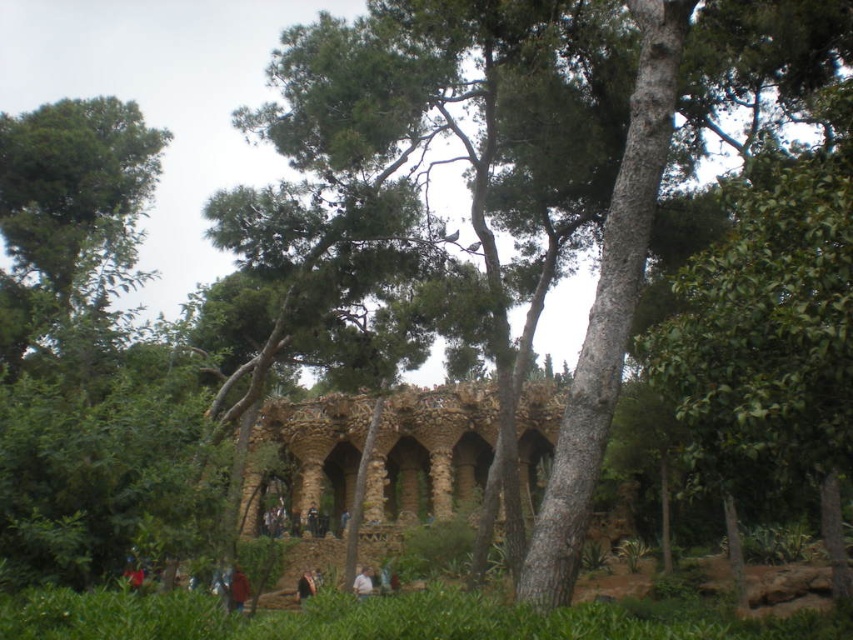
Question: Which object appears closest to the camera in this image?

Choices:
 (A) brown leather jacket at lower center
 (B) red fabric person at lower center
 (C) brown stone ruins at center

Answer: (B)

Question: Which point is closer to the camera?

Choices:
 (A) (309, 516)
 (B) (242, 580)
 (C) (416, 449)
 (D) (368, 595)

Answer: (D)

Question: Is brown stone ruins at center to the left of light brown leather jacket at lower center from the viewer's perspective?

Choices:
 (A) yes
 (B) no

Answer: (B)

Question: Which object is positioned farthest from the brown stone ruins at center?

Choices:
 (A) brown leather jacket at lower center
 (B) dark brown leather jacket at center
 (C) red fabric person at lower center

Answer: (C)

Question: Can you confirm if brown leather jacket at lower center is positioned to the left of dark brown leather jacket at center?

Choices:
 (A) no
 (B) yes

Answer: (A)

Question: From the image, what is the correct spatial relationship of brown stone ruins at center in relation to brown leather jacket at lower center?

Choices:
 (A) below
 (B) above

Answer: (B)